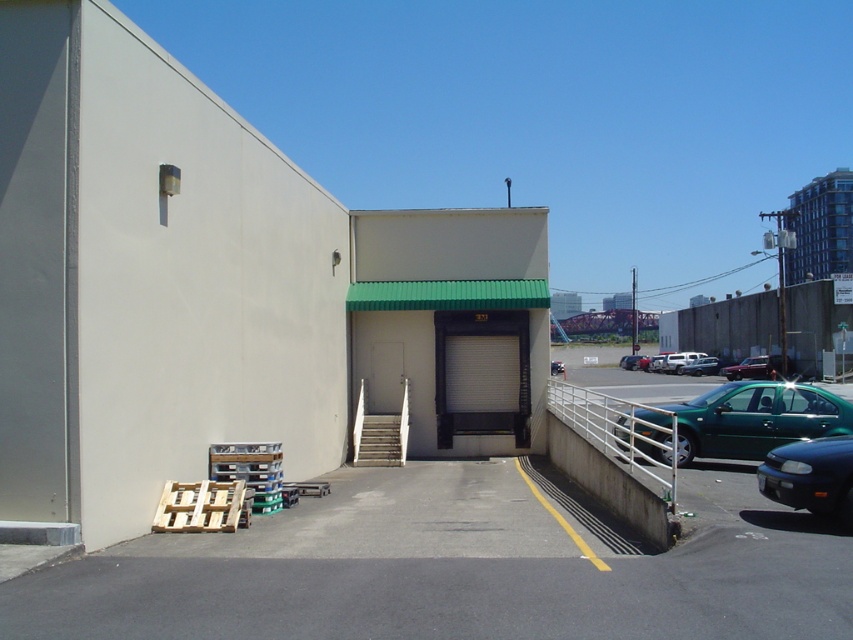
Question: Which point is closer to the camera taking this photo?

Choices:
 (A) (552, 368)
 (B) (715, 368)

Answer: (A)

Question: Which point appears farthest from the camera in this image?

Choices:
 (A) (721, 372)
 (B) (694, 360)
 (C) (780, 384)

Answer: (B)

Question: In this image, where is green matte car at lower right located relative to green matte sedan at center?

Choices:
 (A) above
 (B) below

Answer: (B)

Question: Does green matte sedan at lower right have a smaller size compared to metallic red car at center?

Choices:
 (A) no
 (B) yes

Answer: (B)

Question: Among these objects, which one is farthest from the camera?

Choices:
 (A) green matte car at lower right
 (B) green matte sedan at lower right
 (C) metallic red car at center

Answer: (C)

Question: From the image, what is the correct spatial relationship of green matte car at lower right in relation to green matte sedan at center?

Choices:
 (A) below
 (B) above

Answer: (A)